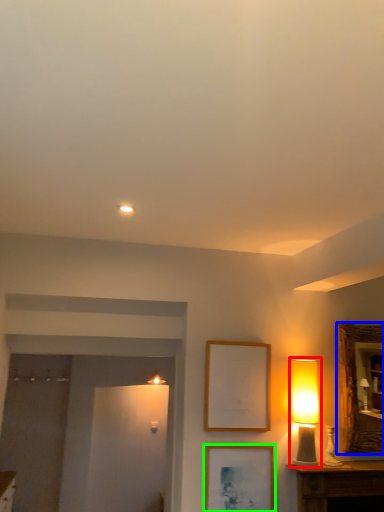
Question: Based on their relative distances, which object is nearer to table lamp (highlighted by a red box)? Choose from mirror (highlighted by a blue box) and picture frame (highlighted by a green box).

Choices:
 (A) mirror
 (B) picture frame

Answer: (A)